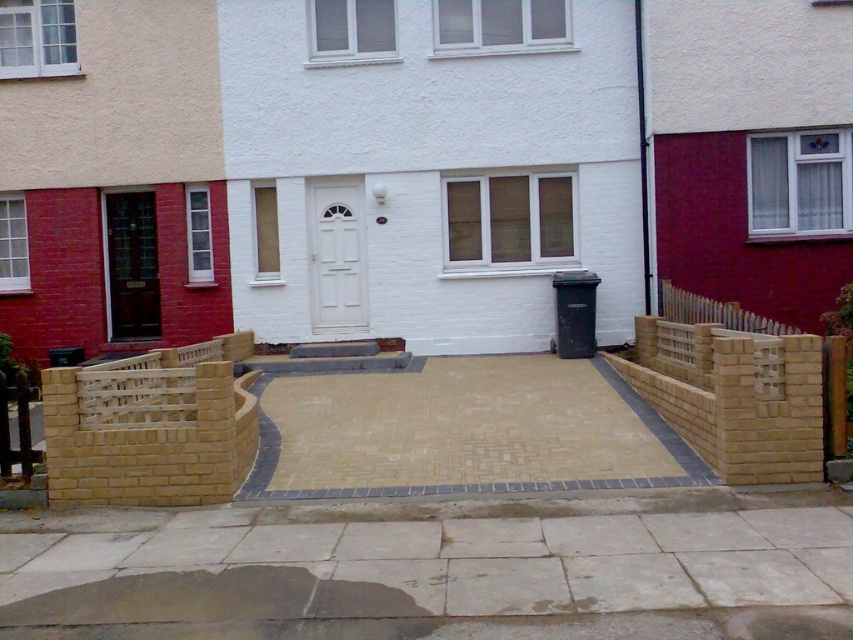
You are a delivery person trying to park your van in the driveway. The van requires a space that is at least as wide as the matte black door at left. Can you determine if the tan paving stones at center provide enough width for the van?

The tan paving stones at center might be wider than matte black door at left, so there is a possibility that the driveway is wide enough for the van. However, since the exact width isn not specified, it is recommended to measure the space before parking.

You are standing at the entrance of the house and want to walk towards the two points marked in the driveway. Which point, point (322, 225) or point (155, 259), is closer to you?

Point (322, 225) is closer to the viewer than point (155, 259).

You are a delivery person trying to enter the house. You see the white matte door at center and the matte black door at left. Which door should you use to enter the house?

The white matte door at center is the correct entrance because it is the front door, typically used for entry, while the matte black door at left might be a service or utility door located below it.